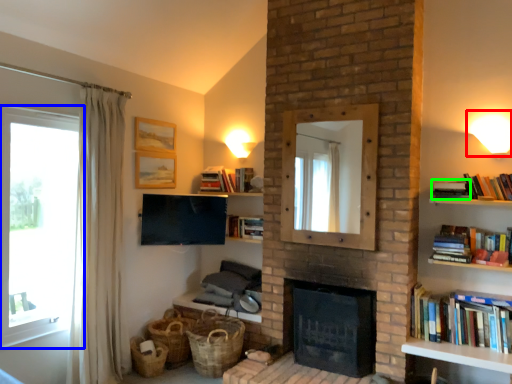
Question: Which object is positioned closest to light fixture (highlighted by a red box)? Select from window (highlighted by a blue box) and book (highlighted by a green box).

Choices:
 (A) window
 (B) book

Answer: (B)